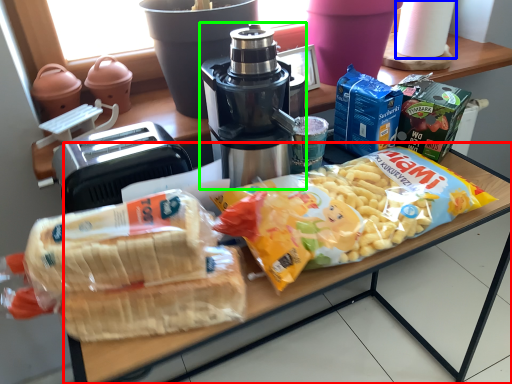
Question: Which object is positioned closest to table (highlighted by a red box)? Select from paper towel (highlighted by a blue box) and coffee maker (highlighted by a green box).

Choices:
 (A) paper towel
 (B) coffee maker

Answer: (B)